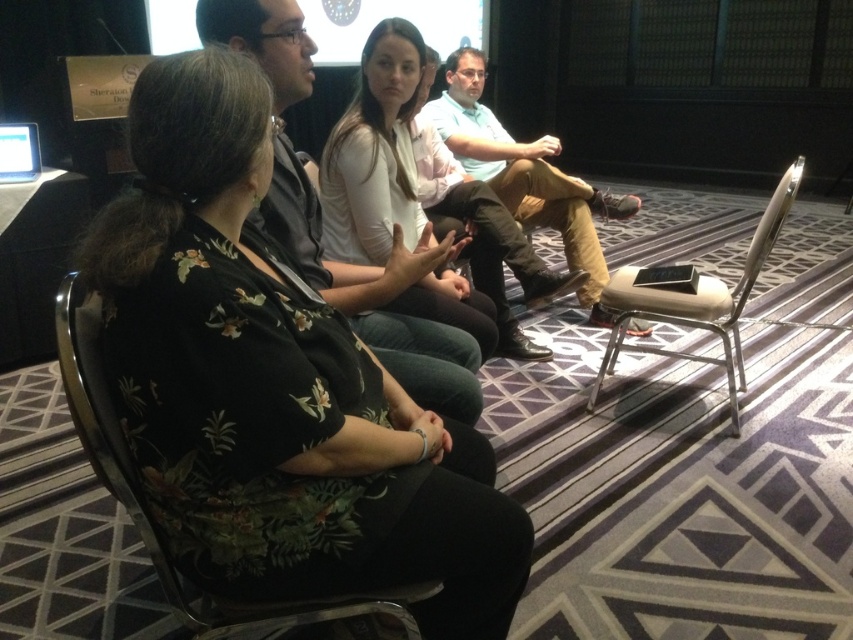
Question: Which object appears farthest from the camera in this image?

Choices:
 (A) metallic silver chair at right
 (B) metallic black chair at center
 (C) matte black shirt at center
 (D) matte white shirt at center

Answer: (A)

Question: Which point is closer to the camera?

Choices:
 (A) matte white screen at upper center
 (B) matte black shirt at center
 (C) matte white shirt at center

Answer: (B)

Question: Does light blue cotton shirt at center have a smaller size compared to metallic black chair at center?

Choices:
 (A) no
 (B) yes

Answer: (A)

Question: Which object is positioned farthest from the matte black shirt at center?

Choices:
 (A) metallic black chair at center
 (B) matte white shirt at center
 (C) floral print blouse at center

Answer: (A)

Question: Considering the relative positions of light blue cotton shirt at center and matte white screen at upper center in the image provided, where is light blue cotton shirt at center located with respect to matte white screen at upper center?

Choices:
 (A) above
 (B) below

Answer: (B)

Question: Where is matte white shirt at center located in relation to light blue cotton shirt at center in the image?

Choices:
 (A) below
 (B) above

Answer: (A)